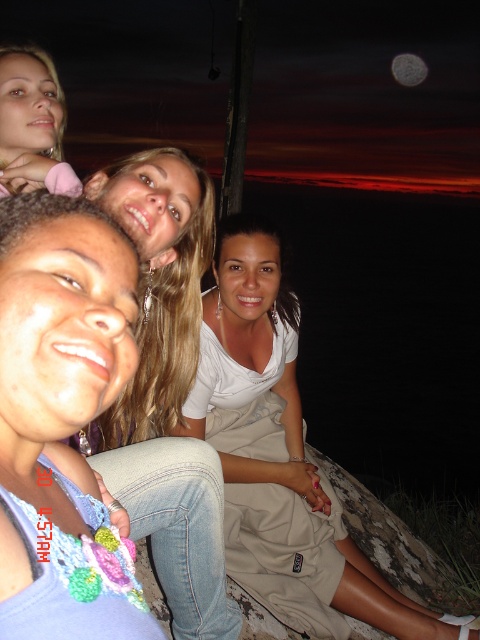
Based on the photo, which is more to the left, matte purple shirt at center or matte pink hair clip at upper left?

From the viewer's perspective, matte pink hair clip at upper left appears more on the left side.

Does matte purple shirt at center have a greater height compared to matte pink hair clip at upper left?

Indeed, matte purple shirt at center has a greater height compared to matte pink hair clip at upper left.

Locate an element on the screen. Image resolution: width=480 pixels, height=640 pixels. matte purple shirt at center is located at coordinates (62, 406).

Is matte purple shirt at center shorter than white cotton dress at center?

Indeed, matte purple shirt at center has a lesser height compared to white cotton dress at center.

Is matte purple shirt at center positioned before white cotton dress at center?

Yes, it is in front of white cotton dress at center.

Is point (91, 282) positioned after point (228, 218)?

No, (91, 282) is in front of (228, 218).

Where is `matte purple shirt at center`? Image resolution: width=480 pixels, height=640 pixels. matte purple shirt at center is located at coordinates (62, 406).

Between white cotton dress at center and matte pink hair clip at upper left, which one has less height?

Standing shorter between the two is matte pink hair clip at upper left.

You are a GUI agent. You are given a task and a screenshot of the screen. Output one action in this format:
    pyautogui.click(x=<x>, y=<y>)
    Task: Click on the white cotton dress at center
    The height and width of the screenshot is (640, 480).
    Given the screenshot: What is the action you would take?
    pyautogui.click(x=280, y=456)

This screenshot has width=480, height=640. In order to click on white cotton dress at center in this screenshot , I will do `click(280, 456)`.